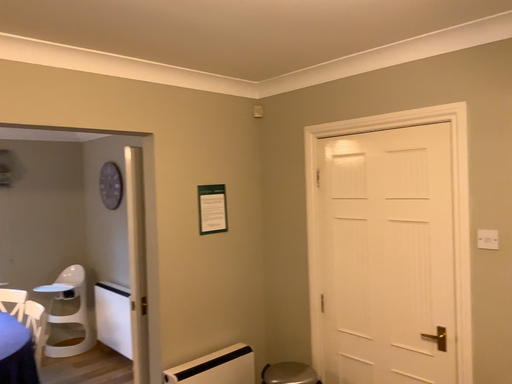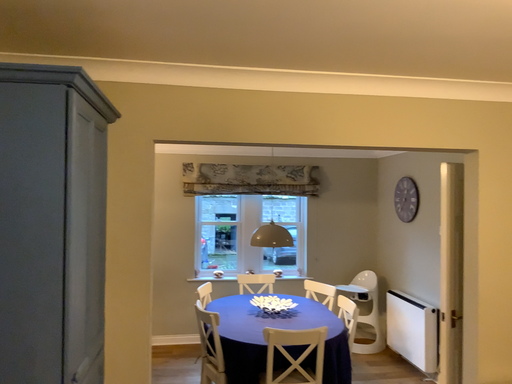
Question: How did the camera likely rotate when shooting the video?

Choices:
 (A) rotated right
 (B) rotated left

Answer: (B)